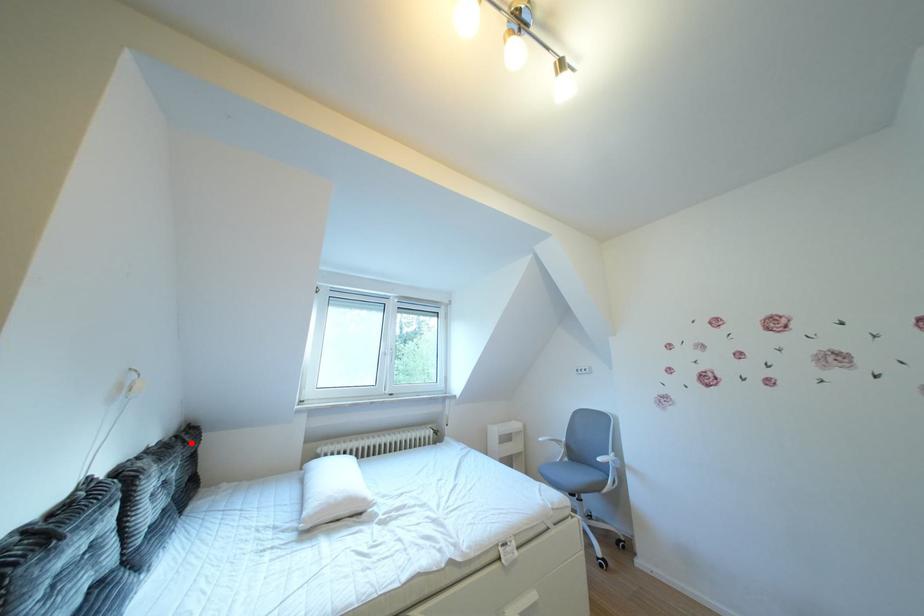
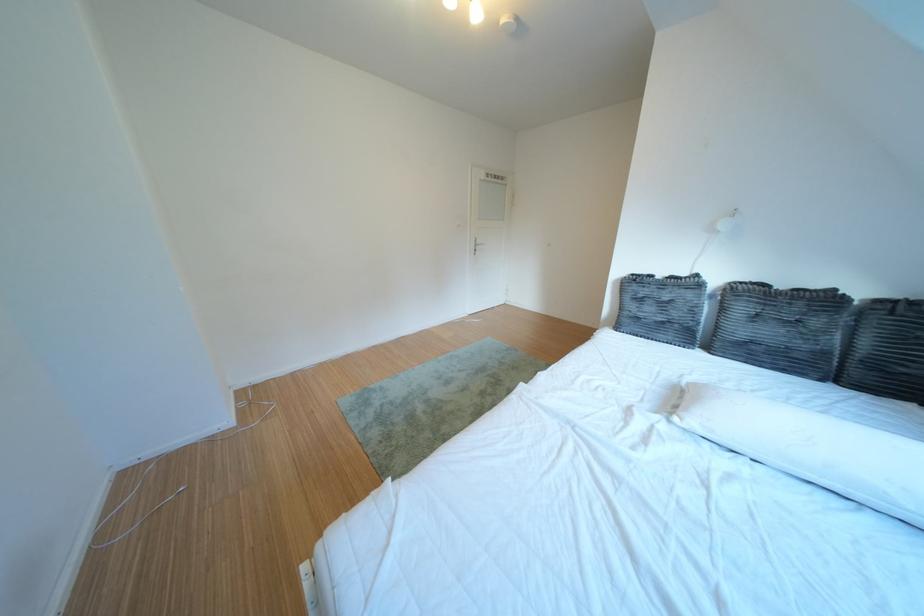
Locate, in the second image, the point that corresponds to the highlighted location in the first image.

(910, 306)